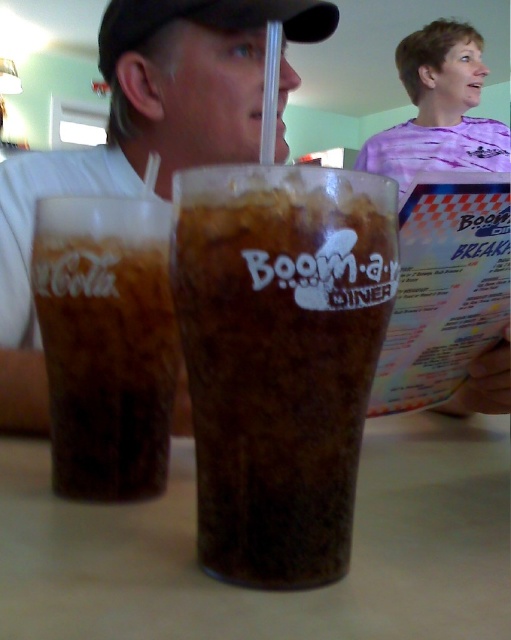
Describe the element at coordinates (141, 140) in the screenshot. This screenshot has height=640, width=511. I see `matte plastic cup at center` at that location.

Is matte plastic cup at center thinner than dark brown glass at center?

No.

Between point (18, 160) and point (52, 310), which one is positioned behind?

Positioned behind is point (18, 160).

You are a GUI agent. You are given a task and a screenshot of the screen. Output one action in this format:
    pyautogui.click(x=<x>, y=<y>)
    Task: Click on the matte plastic cup at center
    The width and height of the screenshot is (511, 640).
    Given the screenshot: What is the action you would take?
    pyautogui.click(x=141, y=140)

Where is `brown frothy drink at center`? The height and width of the screenshot is (640, 511). brown frothy drink at center is located at coordinates (280, 358).

Who is more forward, (236, 509) or (273, 3)?

Point (236, 509) is more forward.

Identify the location of brown frothy drink at center. (280, 358).

Is the position of brown frothy drink at center more distant than that of dark brown glass at center?

That is False.

Who is positioned more to the right, brown frothy drink at center or dark brown glass at center?

brown frothy drink at center

In order to click on brown frothy drink at center in this screenshot , I will do `click(280, 358)`.

Find the location of `brown frothy drink at center`. brown frothy drink at center is located at coordinates (280, 358).